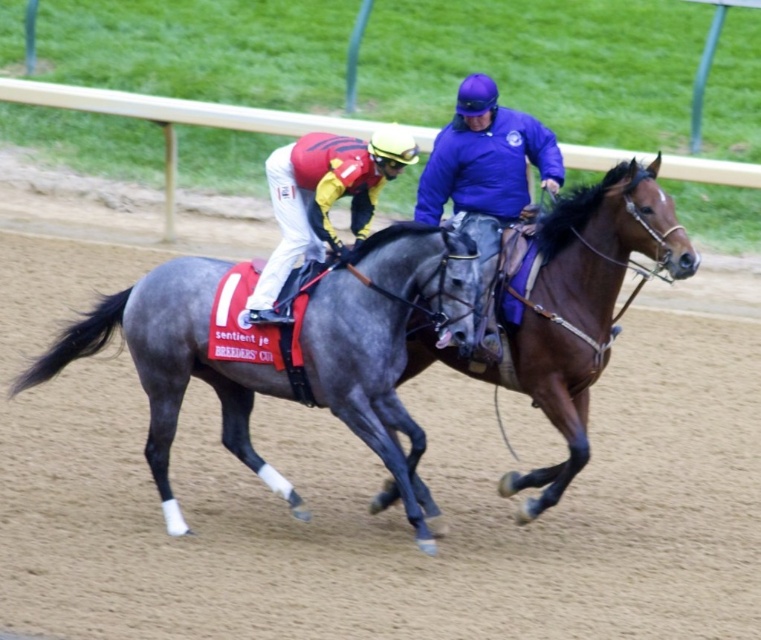
Based on the photo, you are a photographer trying to capture a photo of the brown glossy horse at center and the matte red helmet at center. From the camera view, which object is located to the left?

Answer: The matte red helmet at center is located to the left of the brown glossy horse at center.